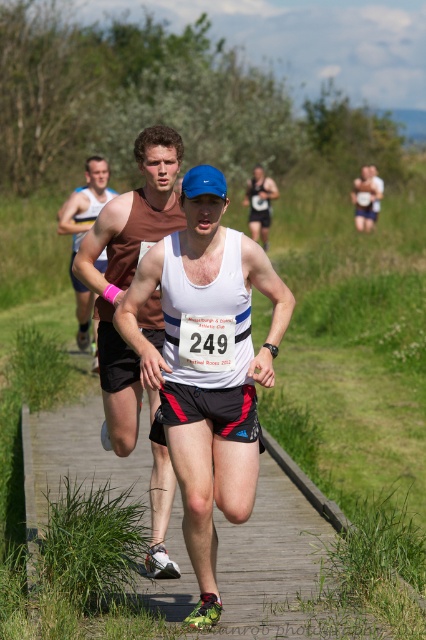
Can you confirm if white matte tank top at center is shorter than matte white tank top at upper center?

Incorrect, white matte tank top at center's height does not fall short of matte white tank top at upper center's.

Does point (206, 609) come in front of point (376, 211)?

Yes, point (206, 609) is closer to viewer.

Image resolution: width=426 pixels, height=640 pixels. Describe the element at coordinates (207, 365) in the screenshot. I see `white matte tank top at center` at that location.

Where is `white matte tank top at center`? The width and height of the screenshot is (426, 640). white matte tank top at center is located at coordinates (207, 365).

Which of these two, matte white tank top at upper center or white paper number at center, stands shorter?

Standing shorter between the two is white paper number at center.

Who is taller, matte white tank top at upper center or white paper number at center?

With more height is matte white tank top at upper center.

You are a GUI agent. You are given a task and a screenshot of the screen. Output one action in this format:
    pyautogui.click(x=<x>, y=<y>)
    Task: Click on the matte white tank top at upper center
    The image size is (426, 640).
    Given the screenshot: What is the action you would take?
    pyautogui.click(x=376, y=193)

Is white matte tank top at center bigger than matte brown tank top at center?

Incorrect, white matte tank top at center is not larger than matte brown tank top at center.

Which is more to the right, white matte tank top at center or matte brown tank top at center?

white matte tank top at center

At what (x,y) coordinates should I click in order to perform the action: click on white matte tank top at center. Please return your answer as a coordinate pair (x, y). Looking at the image, I should click on (207, 365).